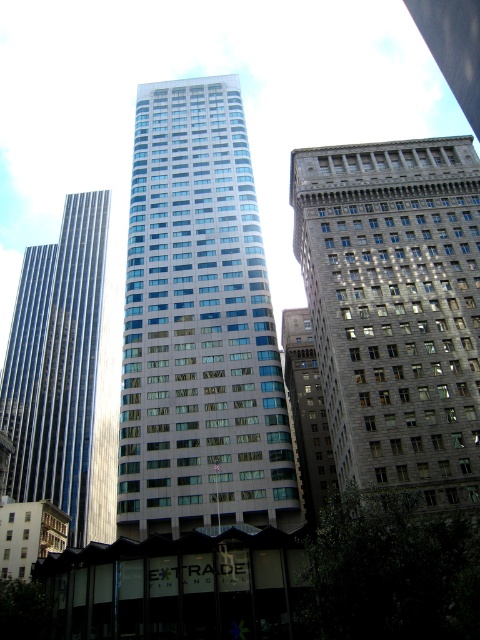
You are a city planner reviewing this urban layout. You need to determine the relative positions of the glassy reflective skyscraper at center and the shiny metallic skyscraper at left. Which one is positioned more to the east if the sun is setting in the west?

The glassy reflective skyscraper at center is to the right of the shiny metallic skyscraper at left. Since the sun is setting in the west, the right side of the image would correspond to the east. Therefore, the glassy reflective skyscraper at center is positioned more to the east than the shiny metallic skyscraper at left.

You are an architect analyzing the urban layout. You notice the glassy reflective skyscraper at center and the dark gray stone building at center. Which of these two buildings is located to the left when viewed from the front?

The glassy reflective skyscraper at center is positioned on the left side of dark gray stone building at center, so it is located to the left when viewed from the front.

Looking at this image, you are standing in the middle of the street looking at the glassy reflective skyscraper at center and the shiny metallic skyscraper at left. Which building would appear larger to you?

The glassy reflective skyscraper at center appears larger because it is closer to the viewer than the shiny metallic skyscraper at left.